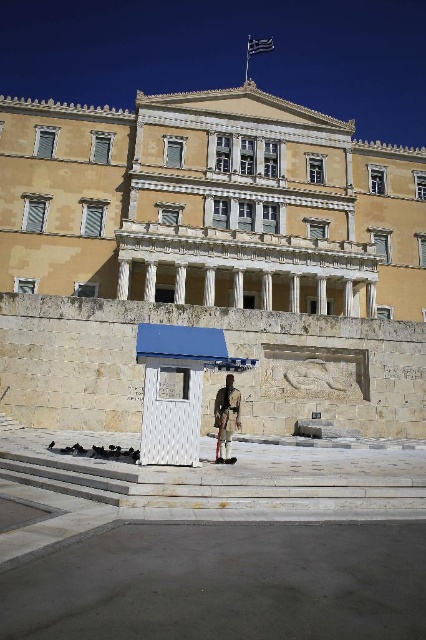
You are a tourist standing in front of the grand neoclassical building. You see the yellow stone building at center and the white plastic bus stop at center. Which one is positioned to the right side?

The yellow stone building at center is positioned to the right of the white plastic bus stop at center.